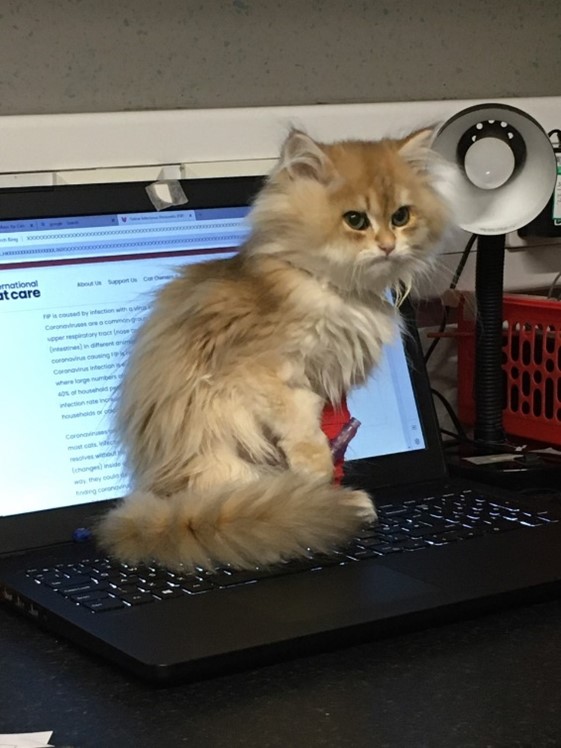
What are the coordinates of `laptop screen` in the screenshot? It's located at (68, 358).